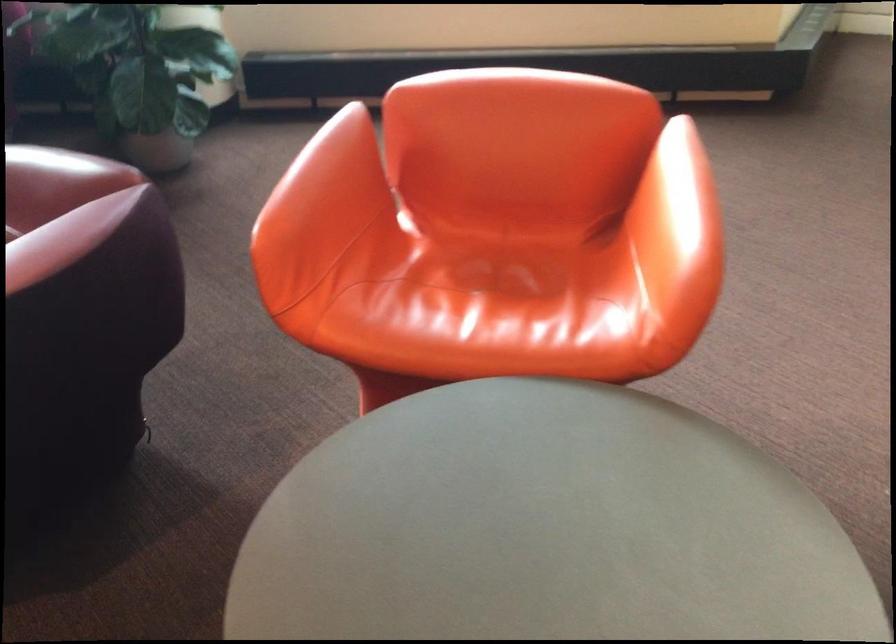
Locate an element on the screen. Image resolution: width=896 pixels, height=644 pixels. orange chair sitting surface is located at coordinates (487, 261).